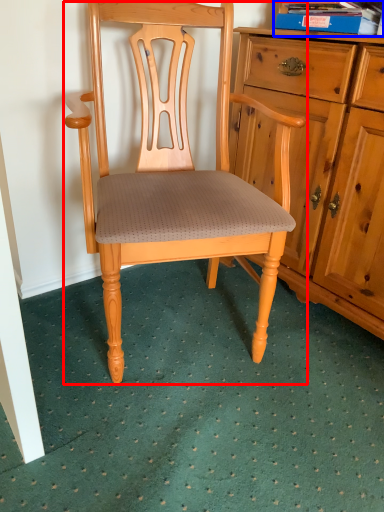
Question: Which object appears farthest to the camera in this image, chair (highlighted by a red box) or book (highlighted by a blue box)?

Choices:
 (A) chair
 (B) book

Answer: (B)